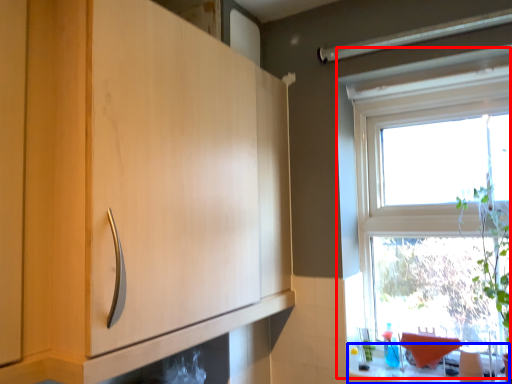
Question: Which object is closer to the camera taking this photo, window (highlighted by a red box) or counter top (highlighted by a blue box)?

Choices:
 (A) window
 (B) counter top

Answer: (B)